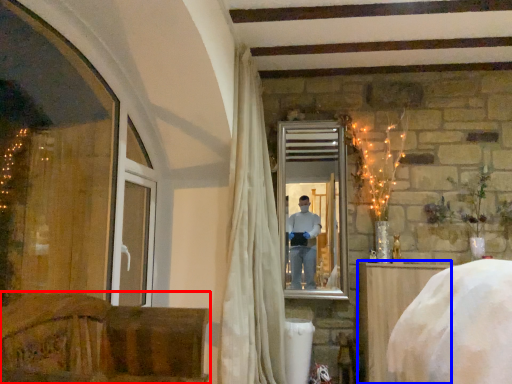
Question: Which object appears closest to the camera in this image, furniture (highlighted by a red box) or furniture (highlighted by a blue box)?

Choices:
 (A) furniture
 (B) furniture

Answer: (A)